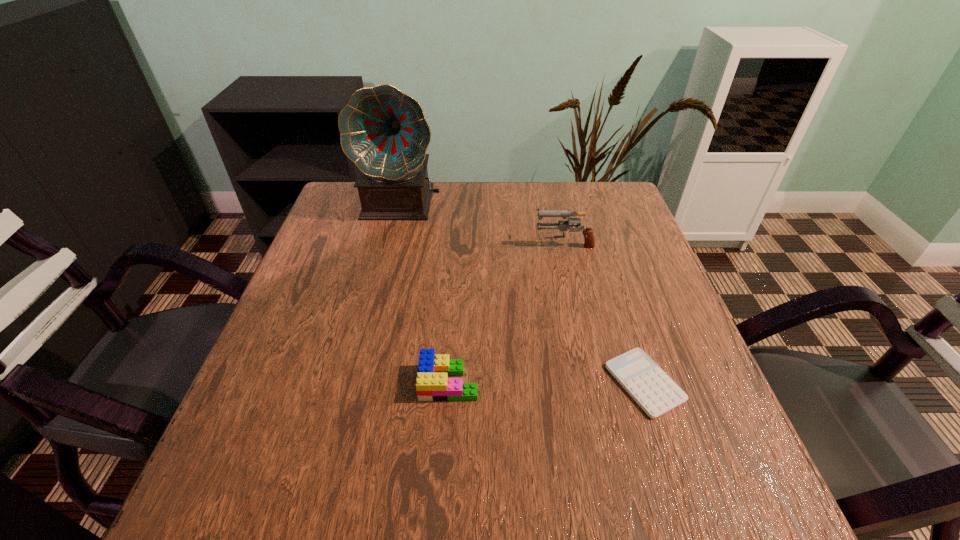
Find the location of a particular element. The width and height of the screenshot is (960, 540). record player is located at coordinates (383, 131).

Where is `the tallest object`? The width and height of the screenshot is (960, 540). the tallest object is located at coordinates (383, 131).

Where is `the second tallest object`? The height and width of the screenshot is (540, 960). the second tallest object is located at coordinates (589, 239).

Image resolution: width=960 pixels, height=540 pixels. In order to click on gun in this screenshot , I will do `click(589, 239)`.

Identify the location of Lego. (432, 384).

This screenshot has height=540, width=960. Identify the location of the third tallest object. (432, 384).

Where is `calculator`? The height and width of the screenshot is (540, 960). calculator is located at coordinates (653, 390).

The image size is (960, 540). What are the coordinates of `free region located 0.130m on the horn of the farthest object` in the screenshot? It's located at (390, 257).

Image resolution: width=960 pixels, height=540 pixels. I want to click on free point located 0.200m at the barrel end of the third shortest object, so click(x=457, y=244).

Identify the location of vacant space located at the barrel end of the third shortest object. (453, 244).